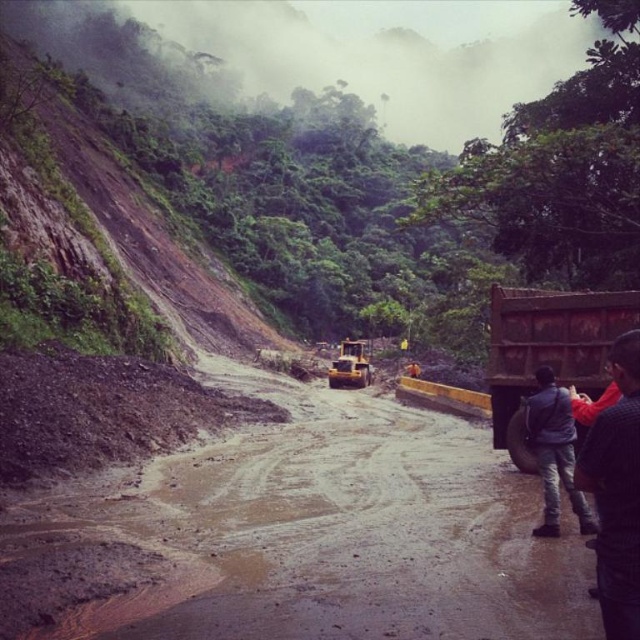
Question: Which point is farther from the camera taking this photo?

Choices:
 (A) (627, 413)
 (B) (545, 461)
 (C) (262, 566)

Answer: (B)

Question: Which object appears closest to the camera in this image?

Choices:
 (A) brown rocky hillside at upper left
 (B) brown muddy dirt track at center

Answer: (B)

Question: Does brown muddy dirt track at center have a lesser width compared to rusty metal truck at right?

Choices:
 (A) no
 (B) yes

Answer: (A)

Question: Can you confirm if brown rocky hillside at upper left is positioned to the left of rusty metal truck at right?

Choices:
 (A) no
 (B) yes

Answer: (B)

Question: Which object appears closest to the camera in this image?

Choices:
 (A) brown rocky hillside at upper left
 (B) dark gray jeans at lower right
 (C) rusty metal truck at right

Answer: (B)

Question: Considering the relative positions of brown rocky hillside at upper left and dark gray jeans at lower right in the image provided, where is brown rocky hillside at upper left located with respect to dark gray jeans at lower right?

Choices:
 (A) right
 (B) left

Answer: (B)